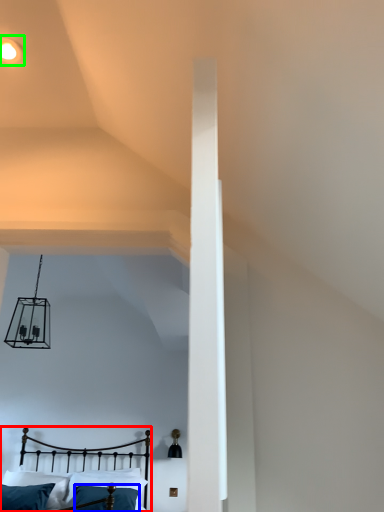
Question: Estimate the real-world distances between objects in this image. Which object is farther from bed (highlighted by a red box), pillow (highlighted by a blue box) or light fixture (highlighted by a green box)?

Choices:
 (A) pillow
 (B) light fixture

Answer: (B)